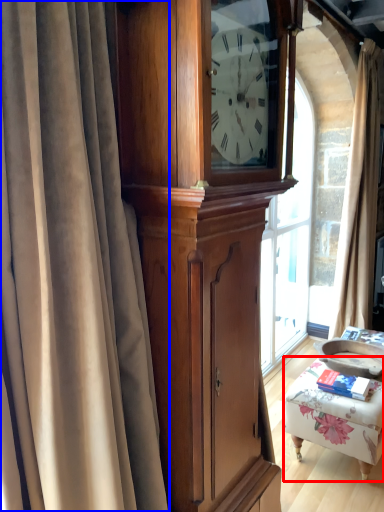
Question: Which object is further to the camera taking this photo, furniture (highlighted by a red box) or curtain (highlighted by a blue box)?

Choices:
 (A) furniture
 (B) curtain

Answer: (A)